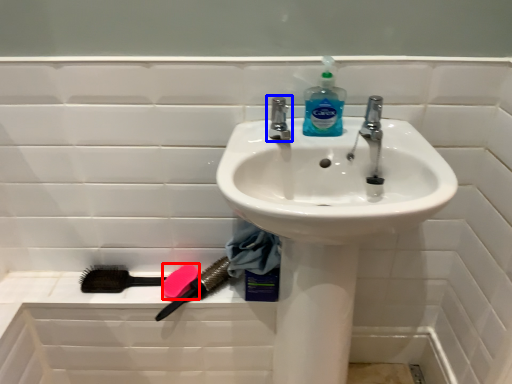
Question: Which point is further to the camera, soap (highlighted by a red box) or tap (highlighted by a blue box)?

Choices:
 (A) soap
 (B) tap

Answer: (A)